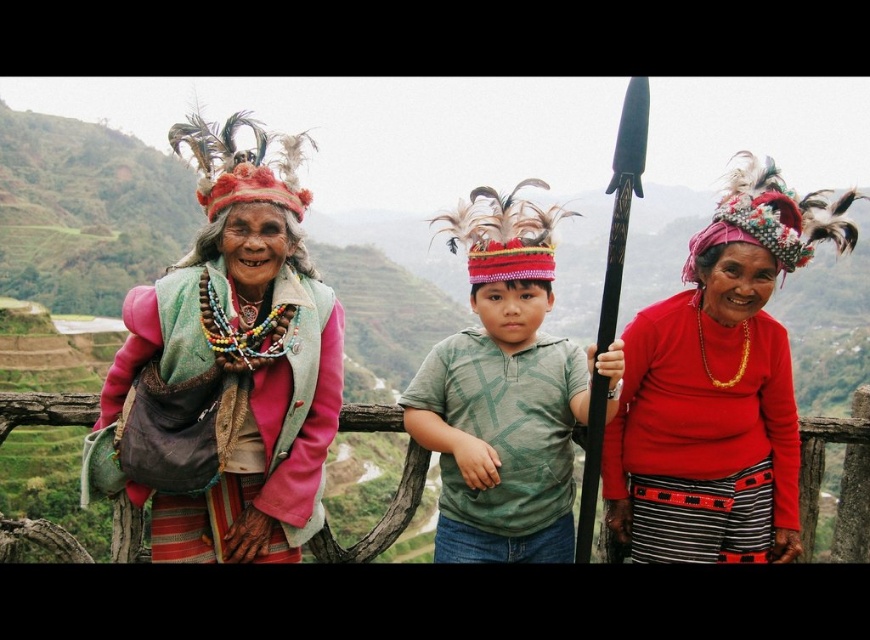
Question: Is matte red sweater at center positioned behind multicolored beaded necklace at center?

Choices:
 (A) yes
 (B) no

Answer: (B)

Question: Among these objects, which one is farthest from the camera?

Choices:
 (A) green cotton shirt at center
 (B) multicolored beaded necklace at center

Answer: (A)

Question: Considering the real-world distances, which object is farthest from the matte red sweater at center?

Choices:
 (A) multicolored beaded necklace at center
 (B) green cotton shirt at center

Answer: (A)

Question: Is matte red sweater at center positioned in front of green cotton shirt at center?

Choices:
 (A) yes
 (B) no

Answer: (A)

Question: Is green cotton shirt at center positioned behind multicolored beaded necklace at center?

Choices:
 (A) yes
 (B) no

Answer: (A)

Question: Which object appears farthest from the camera in this image?

Choices:
 (A) multicolored beaded necklace at center
 (B) green cotton shirt at center
 (C) matte red sweater at center

Answer: (B)